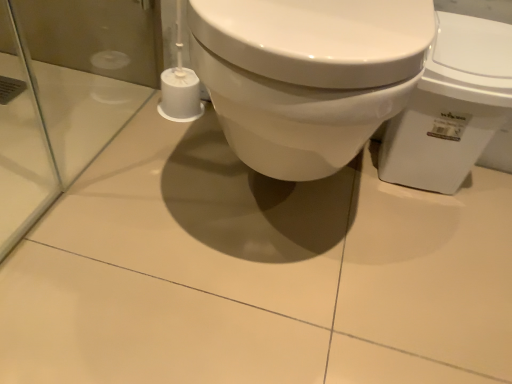
Question: Is white matte toilet paper at lower left with white glossy toilet at right?

Choices:
 (A) yes
 (B) no

Answer: (B)

Question: Is white matte toilet paper at lower left bigger than white glossy toilet at right?

Choices:
 (A) no
 (B) yes

Answer: (A)

Question: Is white matte toilet paper at lower left located outside white glossy toilet at right?

Choices:
 (A) yes
 (B) no

Answer: (A)

Question: Is white matte toilet paper at lower left further to the viewer compared to white glossy toilet at right?

Choices:
 (A) yes
 (B) no

Answer: (A)

Question: Can you confirm if white matte toilet paper at lower left is wider than white glossy toilet at right?

Choices:
 (A) no
 (B) yes

Answer: (A)

Question: Does white matte toilet paper at lower left have a greater height compared to white glossy toilet at right?

Choices:
 (A) no
 (B) yes

Answer: (A)

Question: From the image's perspective, is white glossy toilet at right beneath white matte toilet paper at lower left?

Choices:
 (A) yes
 (B) no

Answer: (A)

Question: Does white glossy toilet at right have a greater width compared to white matte toilet paper at lower left?

Choices:
 (A) yes
 (B) no

Answer: (A)

Question: Does white glossy toilet at right have a greater height compared to white matte toilet paper at lower left?

Choices:
 (A) no
 (B) yes

Answer: (B)

Question: From the image's perspective, does white glossy toilet at right appear higher than white matte toilet paper at lower left?

Choices:
 (A) yes
 (B) no

Answer: (B)

Question: Is white matte toilet paper at lower left at the back of white glossy toilet at right?

Choices:
 (A) yes
 (B) no

Answer: (B)

Question: Does white glossy toilet at right have a larger size compared to white matte toilet paper at lower left?

Choices:
 (A) yes
 (B) no

Answer: (A)

Question: Considering their positions, is white glossy toilet at right located in front of or behind white matte toilet paper at lower left?

Choices:
 (A) behind
 (B) front

Answer: (B)